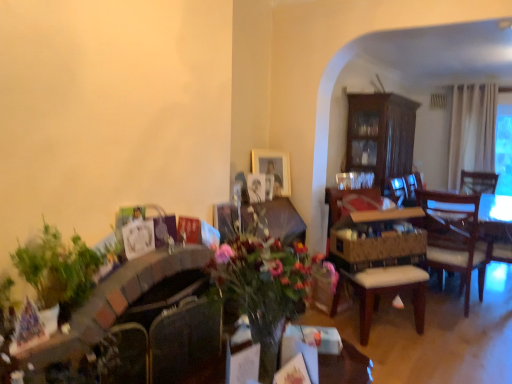
Question: Would you consider green leafy plant at left to be distant from wooden cushioned chair at center?

Choices:
 (A) yes
 (B) no

Answer: (A)

Question: Does green leafy plant at left have a greater height compared to wooden cushioned chair at center?

Choices:
 (A) yes
 (B) no

Answer: (B)

Question: Does green leafy plant at left have a smaller size compared to wooden cushioned chair at center?

Choices:
 (A) yes
 (B) no

Answer: (A)

Question: Does green leafy plant at left come behind wooden cushioned chair at center?

Choices:
 (A) no
 (B) yes

Answer: (A)

Question: Does green leafy plant at left have a greater width compared to wooden cushioned chair at center?

Choices:
 (A) no
 (B) yes

Answer: (A)

Question: Is green leafy plant at left bigger than wooden cushioned chair at center?

Choices:
 (A) no
 (B) yes

Answer: (A)

Question: Can you confirm if wooden table at center is positioned to the left of gold metallic picture frame at upper center?

Choices:
 (A) yes
 (B) no

Answer: (A)

Question: From a real-world perspective, does wooden table at center stand above gold metallic picture frame at upper center?

Choices:
 (A) no
 (B) yes

Answer: (A)

Question: Is wooden table at center positioned beyond the bounds of gold metallic picture frame at upper center?

Choices:
 (A) yes
 (B) no

Answer: (A)

Question: Does wooden table at center have a lesser width compared to gold metallic picture frame at upper center?

Choices:
 (A) yes
 (B) no

Answer: (B)

Question: Can you confirm if wooden table at center is shorter than gold metallic picture frame at upper center?

Choices:
 (A) yes
 (B) no

Answer: (B)

Question: Does wooden table at center appear on the right side of gold metallic picture frame at upper center?

Choices:
 (A) yes
 (B) no

Answer: (B)

Question: Can you confirm if wooden cushioned chair at center is thinner than wooden table at center?

Choices:
 (A) yes
 (B) no

Answer: (A)